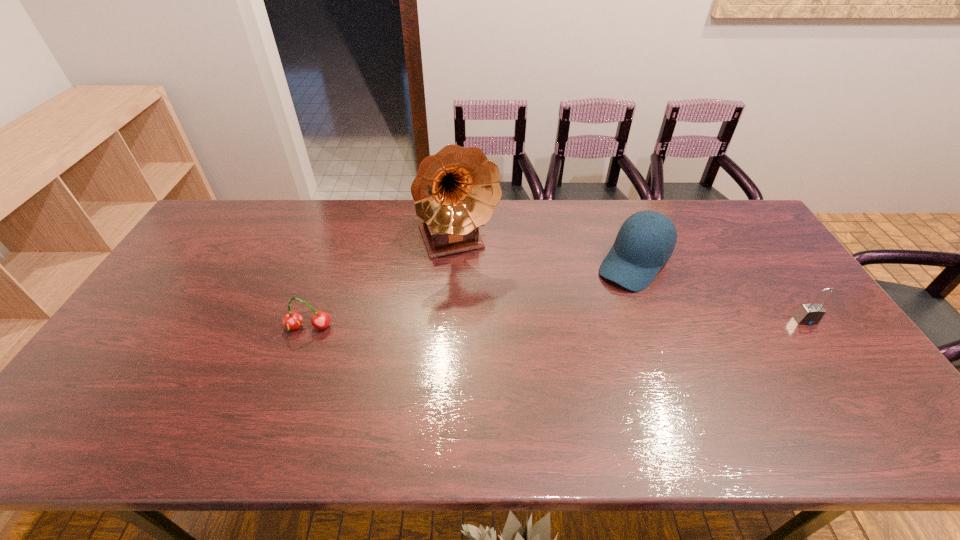
Where is `the leftmost object`? The width and height of the screenshot is (960, 540). the leftmost object is located at coordinates (292, 320).

Identify the location of the rightmost object. (808, 314).

This screenshot has width=960, height=540. What are the coordinates of `the third shortest object` in the screenshot? It's located at (646, 240).

Locate an element on the screen. the second object from right to left is located at coordinates (646, 240).

Locate an element on the screen. Image resolution: width=960 pixels, height=540 pixels. the tallest object is located at coordinates [455, 192].

This screenshot has width=960, height=540. What are the coordinates of `the third object from right to left` in the screenshot? It's located at (455, 192).

I want to click on vacant space located with stems pointing upwards on the cherry, so click(x=285, y=394).

At what (x,y) coordinates should I click in order to perform the action: click on vacant space located 0.120m on the shackle of the rightmost object. Please return your answer as a coordinate pair (x, y). This screenshot has height=540, width=960. Looking at the image, I should click on (834, 362).

Identify the location of vacant space situated on the front-facing side of the second object from right to left. This screenshot has height=540, width=960. (557, 355).

Where is `vacant space located on the front-facing side of the second object from right to left`? The image size is (960, 540). vacant space located on the front-facing side of the second object from right to left is located at coordinates (557, 355).